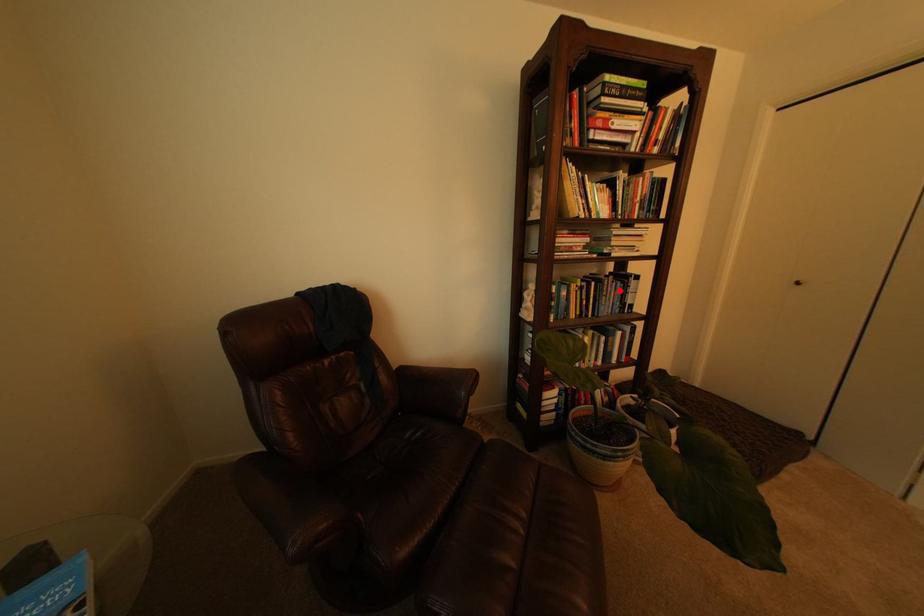
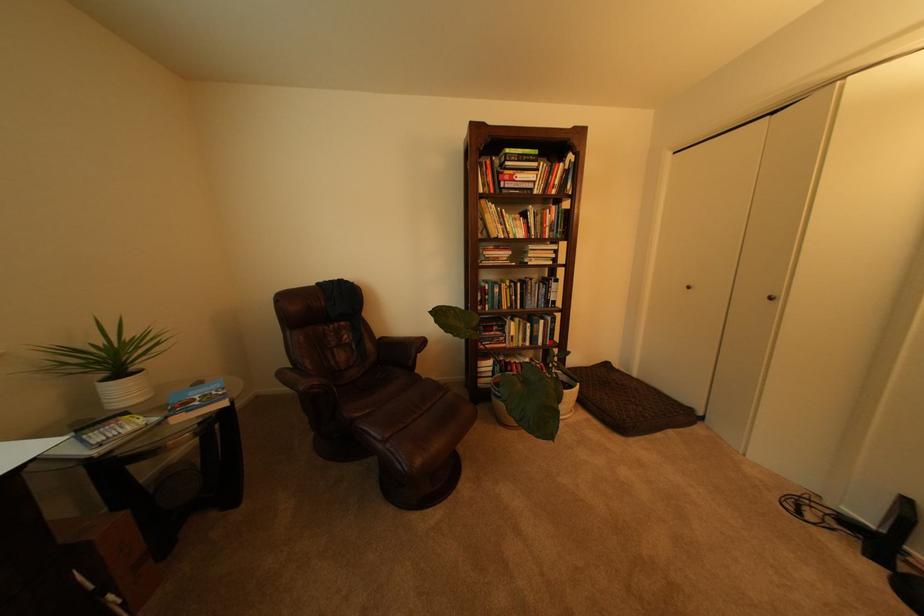
Locate, in the second image, the point that corresponds to the highlighted location in the first image.

(543, 290)